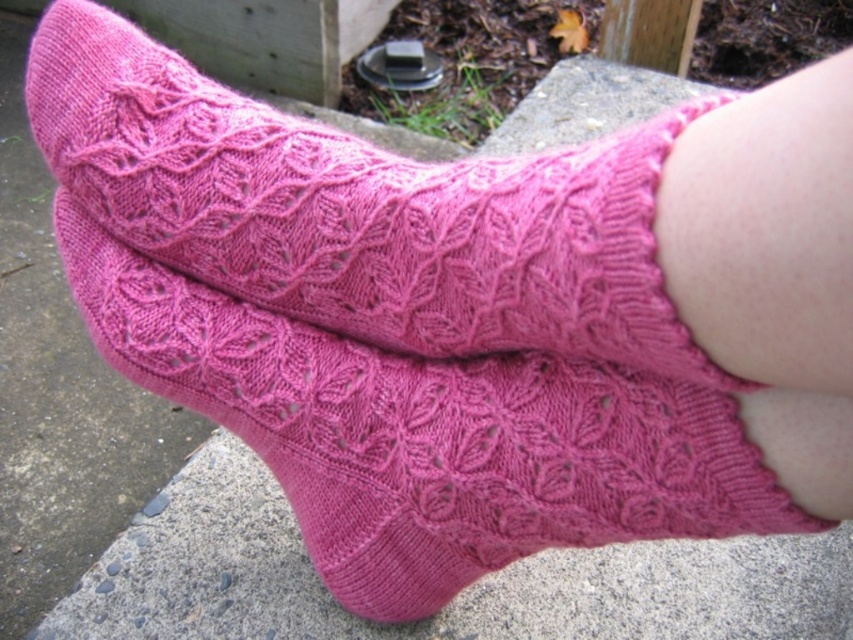
Question: Does pink knitted socks at center appear under matte pink socks at center?

Choices:
 (A) no
 (B) yes

Answer: (B)

Question: Does pink knitted socks at center come in front of matte pink socks at center?

Choices:
 (A) yes
 (B) no

Answer: (B)

Question: Can you confirm if pink knitted socks at center is positioned to the right of matte pink socks at center?

Choices:
 (A) yes
 (B) no

Answer: (A)

Question: Which point is closer to the camera?

Choices:
 (A) (294, 253)
 (B) (177, 288)

Answer: (A)